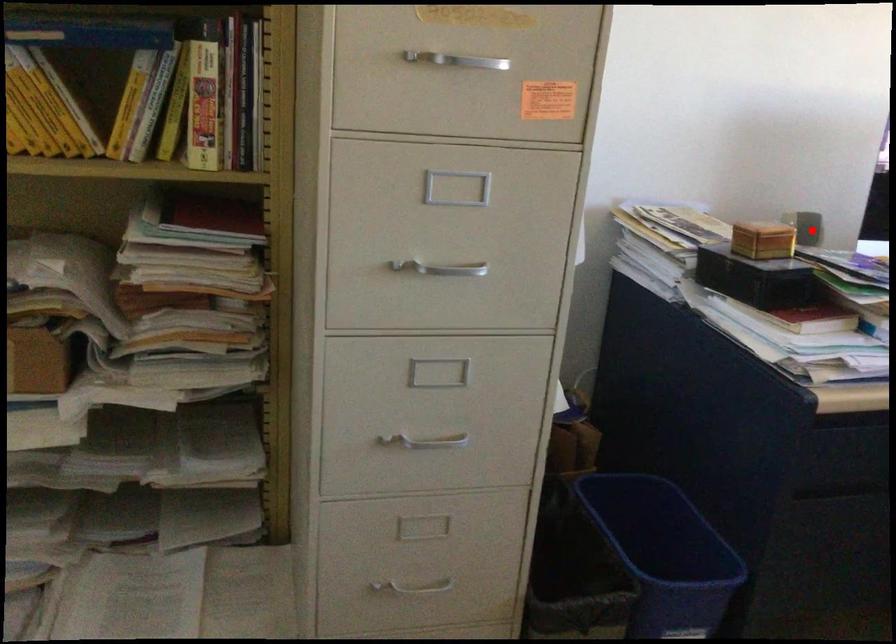
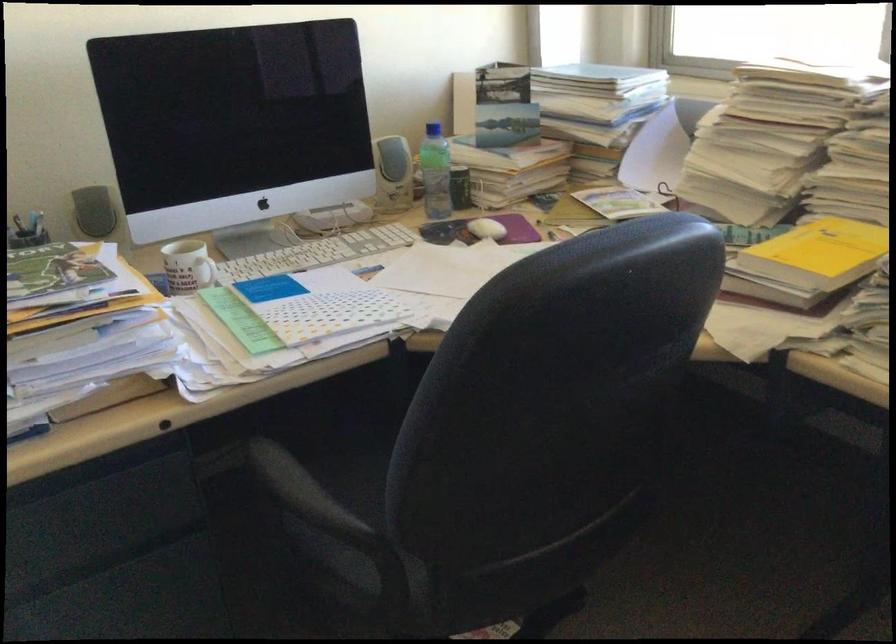
Question: A red point is marked in image1. In image2, is the corresponding 3D point closer to the camera or farther? Reply with the corresponding letter.

Choices:
 (A) The corresponding 3D point is closer.
 (B) The corresponding 3D point is farther.

Answer: (A)